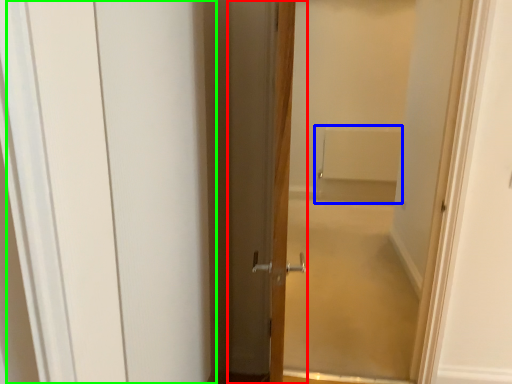
Question: Based on their relative distances, which object is nearer to door (highlighted by a red box)? Choose from bath (highlighted by a blue box) and barn door (highlighted by a green box).

Choices:
 (A) bath
 (B) barn door

Answer: (B)